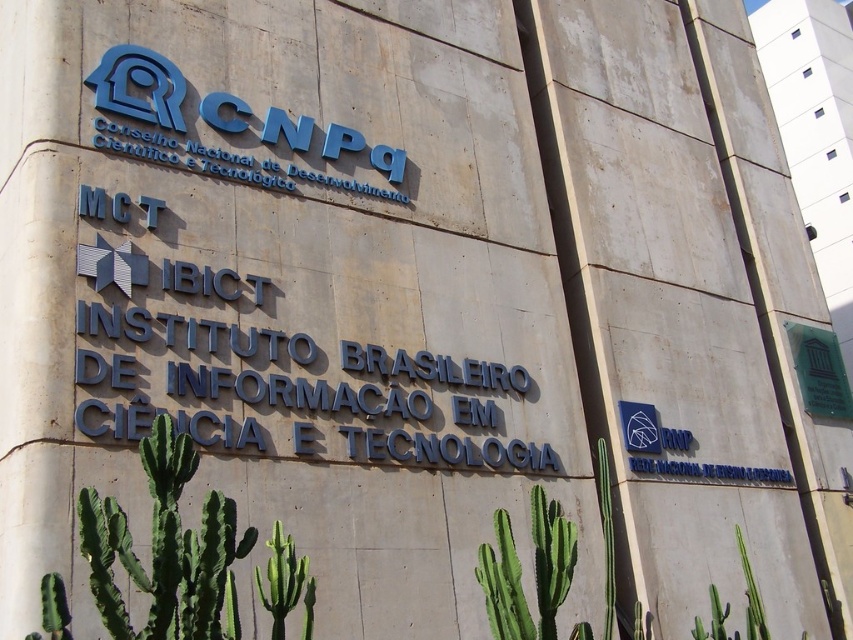
How far apart are green spiny cactus at lower left and blue plastic sign at upper center?

green spiny cactus at lower left is 40.03 feet away from blue plastic sign at upper center.

Does green spiny cactus at lower left have a greater width compared to blue plastic sign at upper center?

Incorrect, green spiny cactus at lower left's width does not surpass blue plastic sign at upper center's.

Is point (222, 524) positioned behind point (131, 106)?

No, (222, 524) is in front of (131, 106).

Locate an element on the screen. The height and width of the screenshot is (640, 853). green spiny cactus at lower left is located at coordinates (166, 548).

Is green spiny cactus at lower left thinner than green glass plaque at upper right?

In fact, green spiny cactus at lower left might be wider than green glass plaque at upper right.

At what (x,y) coordinates should I click in order to perform the action: click on green spiny cactus at lower left. Please return your answer as a coordinate pair (x, y). The height and width of the screenshot is (640, 853). Looking at the image, I should click on (166, 548).

Who is positioned more to the left, blue plastic sign at upper center or green glass plaque at upper right?

Positioned to the left is blue plastic sign at upper center.

What do you see at coordinates (138, 86) in the screenshot?
I see `blue plastic sign at upper center` at bounding box center [138, 86].

What do you see at coordinates (138, 86) in the screenshot? The image size is (853, 640). I see `blue plastic sign at upper center` at bounding box center [138, 86].

Where is `blue plastic sign at upper center`? This screenshot has height=640, width=853. blue plastic sign at upper center is located at coordinates (138, 86).